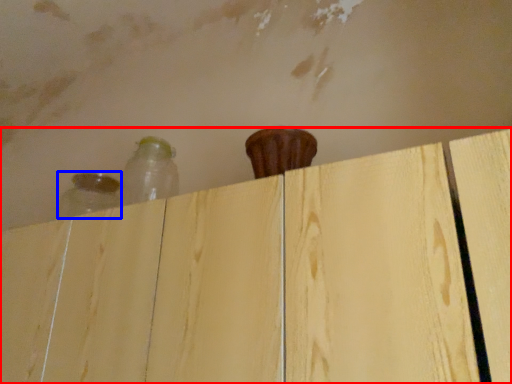
Question: Which of the following is the farthest to the observer, dresser (highlighted by a red box) or bottle (highlighted by a blue box)?

Choices:
 (A) dresser
 (B) bottle

Answer: (B)